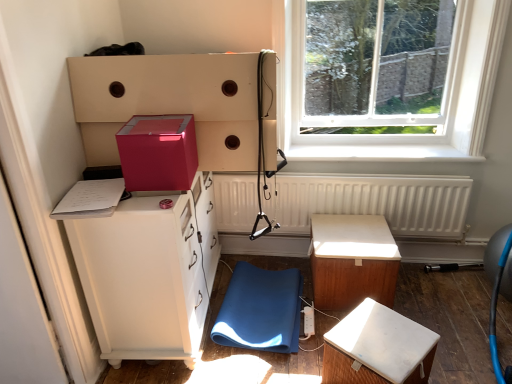
Question: Can you confirm if blue fabric swivel chair at lower center is thinner than transparent glass window at upper right?

Choices:
 (A) no
 (B) yes

Answer: (A)

Question: Is blue fabric swivel chair at lower center positioned with its back to transparent glass window at upper right?

Choices:
 (A) yes
 (B) no

Answer: (B)

Question: Is blue fabric swivel chair at lower center touching transparent glass window at upper right?

Choices:
 (A) yes
 (B) no

Answer: (B)

Question: Could you tell me if blue fabric swivel chair at lower center is turned towards transparent glass window at upper right?

Choices:
 (A) no
 (B) yes

Answer: (A)

Question: Would you say transparent glass window at upper right is part of blue fabric swivel chair at lower center's contents?

Choices:
 (A) yes
 (B) no

Answer: (B)

Question: Based on their positions, is transparent glass window at upper right located to the left or right of matte pink cube at upper center?

Choices:
 (A) right
 (B) left

Answer: (A)

Question: Considering the positions of point (338, 148) and point (106, 61), is point (338, 148) closer or farther from the camera than point (106, 61)?

Choices:
 (A) farther
 (B) closer

Answer: (A)

Question: From the image's perspective, relative to matte pink cube at upper center, is transparent glass window at upper right above or below?

Choices:
 (A) above
 (B) below

Answer: (A)

Question: In terms of height, does transparent glass window at upper right look taller or shorter compared to matte pink cube at upper center?

Choices:
 (A) short
 (B) tall

Answer: (B)

Question: Is wooden table at center taller or shorter than matte pink cube at upper center?

Choices:
 (A) tall
 (B) short

Answer: (A)

Question: Would you say wooden table at center is to the left or to the right of matte pink cube at upper center in the picture?

Choices:
 (A) right
 (B) left

Answer: (A)

Question: From a real-world perspective, is wooden table at center above or below matte pink cube at upper center?

Choices:
 (A) above
 (B) below

Answer: (B)

Question: Choose the correct answer: Is wooden table at center inside matte pink cube at upper center or outside it?

Choices:
 (A) outside
 (B) inside

Answer: (A)

Question: From the image's perspective, relative to blue fabric swivel chair at lower center, is matte white cabinet at left above or below?

Choices:
 (A) above
 (B) below

Answer: (A)

Question: Looking at their shapes, would you say matte white cabinet at left is wider or thinner than blue fabric swivel chair at lower center?

Choices:
 (A) wide
 (B) thin

Answer: (B)